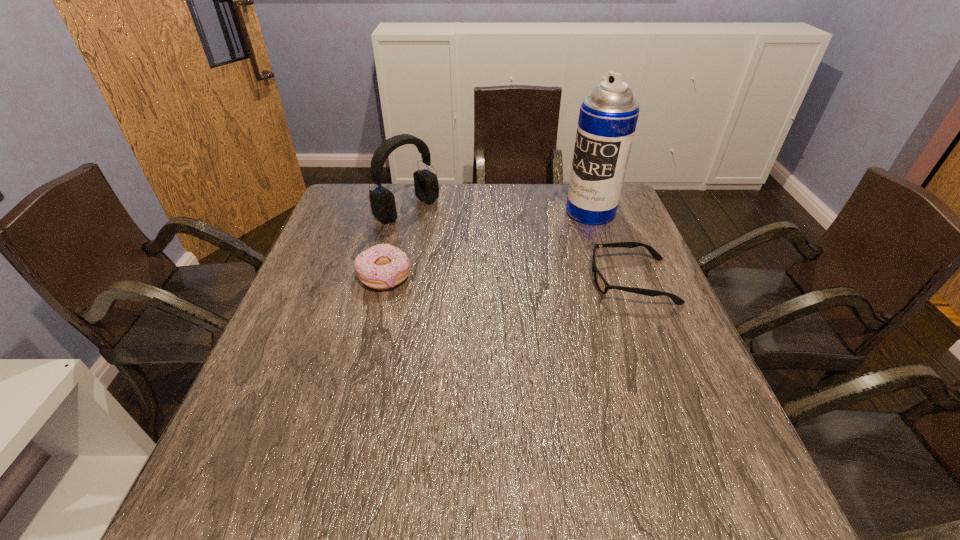
Image resolution: width=960 pixels, height=540 pixels. In order to click on object that is at the far left corner in this screenshot , I will do `click(382, 200)`.

At what (x,y) coordinates should I click in order to perform the action: click on object at the far right corner. Please return your answer as a coordinate pair (x, y). The image size is (960, 540). Looking at the image, I should click on (608, 116).

You are a GUI agent. You are given a task and a screenshot of the screen. Output one action in this format:
    pyautogui.click(x=<x>, y=<y>)
    Task: Click on the free spot at the near edge of the desktop
    This screenshot has height=540, width=960.
    Given the screenshot: What is the action you would take?
    pyautogui.click(x=520, y=420)

In the image, there is a desktop. Identify the location of free space at the left edge. (329, 276).

The image size is (960, 540). What are the coordinates of `free space at the right edge of the desktop` in the screenshot? It's located at (665, 382).

Locate an element on the screen. This screenshot has width=960, height=540. vacant space at the far left corner of the desktop is located at coordinates (346, 184).

The width and height of the screenshot is (960, 540). In the image, there is a desktop. In order to click on vacant area at the near right corner in this screenshot , I will do `click(662, 441)`.

Identify the location of vacant region between the tallest object and the third tallest object. (488, 245).

What are the coordinates of `free spot between the second tallest object and the spectacles` in the screenshot? It's located at (519, 245).

Where is `vacant region between the second shortest object and the spectacles`? This screenshot has width=960, height=540. vacant region between the second shortest object and the spectacles is located at coordinates pos(508,279).